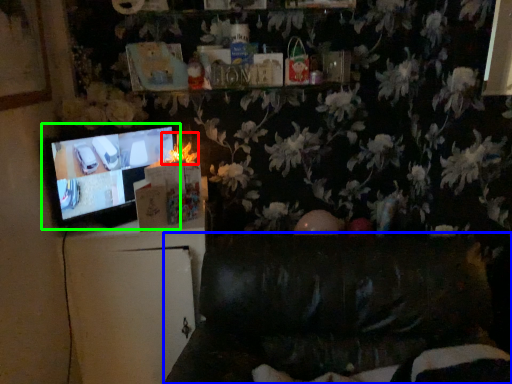
Question: Which object is the farthest from flower (highlighted by a red box)? Choose among these: furniture (highlighted by a blue box) or television (highlighted by a green box).

Choices:
 (A) furniture
 (B) television

Answer: (A)